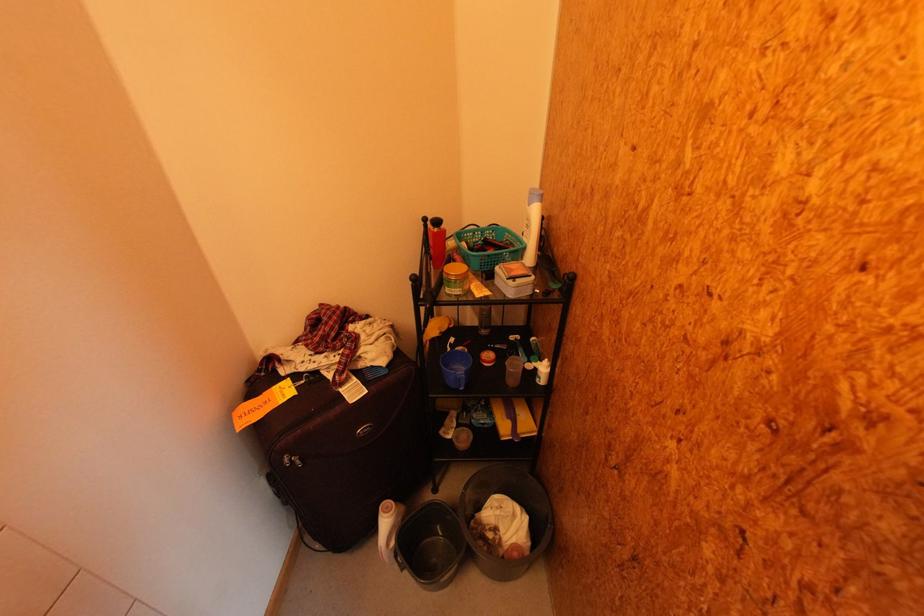
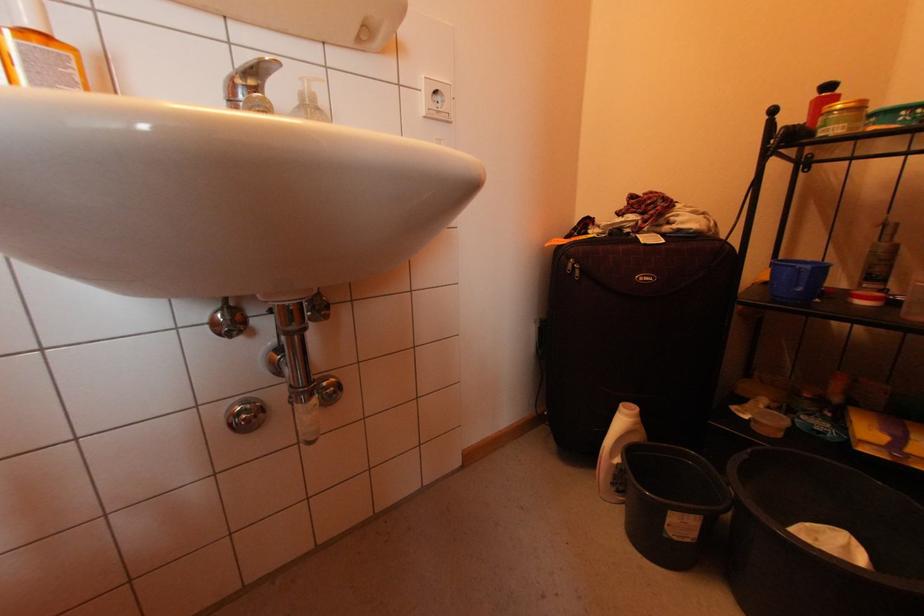
Where in the second image is the point corresponding to point (464, 291) from the first image?

(845, 126)